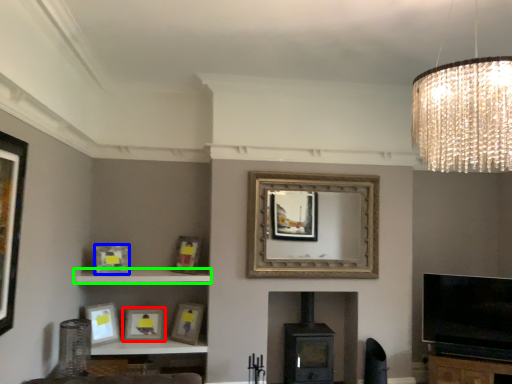
Question: Which object is the closest to the picture frame (highlighted by a red box)? Choose among these: picture frame (highlighted by a blue box) or shelf (highlighted by a green box).

Choices:
 (A) picture frame
 (B) shelf

Answer: (B)